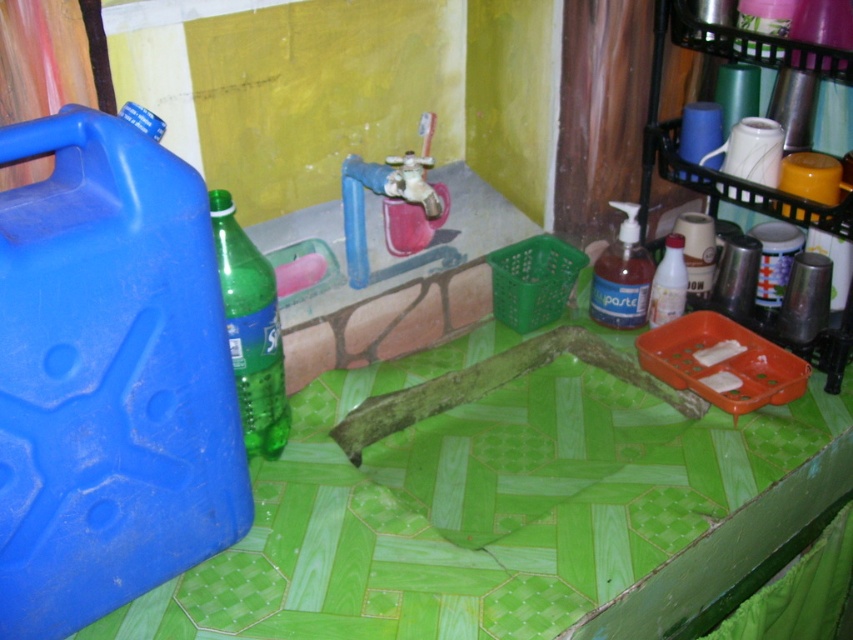
You are taking a photo of the kitchen and want to focus on both point A at point (144, 602) and point B at point (254, 400). Which point should you focus on first to ensure both are in focus?

You should focus on point A at point (144, 602) first because it is closer to the camera than point B at point (254, 400). This way, both points will be in focus as the depth of field will cover the distance between them.

You are organizing items in the kitchen and need to place a new item between the green wood table at center and the green matte bottle at center. Based on their positions, which object should you place the item closer to if you want it to be on the left side of the table?

The item should be placed closer to the green matte bottle at center because the green wood table at center is to the right of the green matte bottle at center, so the bottle is on the left side relative to the table.